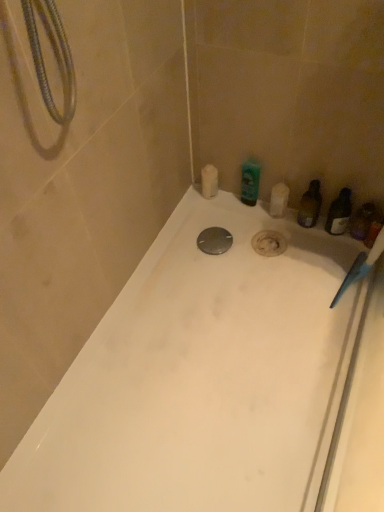
The image size is (384, 512). Find the location of `free space that is to the left of green glossy bottle at upper right, acting as the 3th toiletry starting from the right`. free space that is to the left of green glossy bottle at upper right, acting as the 3th toiletry starting from the right is located at coordinates (206, 215).